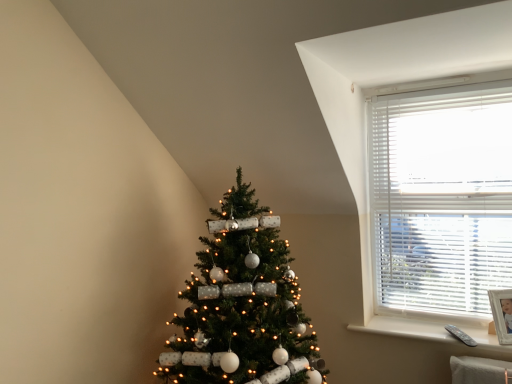
Question: From a real-world perspective, is green matte christmas tree at center located beneath white blinds at upper right?

Choices:
 (A) no
 (B) yes

Answer: (B)

Question: Are green matte christmas tree at center and white blinds at upper right located far from each other?

Choices:
 (A) no
 (B) yes

Answer: (A)

Question: Does green matte christmas tree at center have a larger size compared to white blinds at upper right?

Choices:
 (A) yes
 (B) no

Answer: (A)

Question: Does green matte christmas tree at center turn towards white blinds at upper right?

Choices:
 (A) yes
 (B) no

Answer: (B)

Question: Is green matte christmas tree at center not inside white blinds at upper right?

Choices:
 (A) yes
 (B) no

Answer: (A)

Question: Is green matte christmas tree at center bigger or smaller than white plastic remote at lower right?

Choices:
 (A) small
 (B) big

Answer: (B)

Question: Relative to white plastic remote at lower right, is green matte christmas tree at center in front or behind?

Choices:
 (A) front
 (B) behind

Answer: (A)

Question: From a real-world perspective, is green matte christmas tree at center positioned above or below white plastic remote at lower right?

Choices:
 (A) above
 (B) below

Answer: (A)

Question: Is green matte christmas tree at center inside the boundaries of white plastic remote at lower right, or outside?

Choices:
 (A) inside
 (B) outside

Answer: (B)

Question: Which is correct: green matte christmas tree at center is inside white blinds at upper right, or outside of it?

Choices:
 (A) inside
 (B) outside

Answer: (B)

Question: From the image's perspective, is green matte christmas tree at center above or below white blinds at upper right?

Choices:
 (A) above
 (B) below

Answer: (B)

Question: Is green matte christmas tree at center wider or thinner than white blinds at upper right?

Choices:
 (A) thin
 (B) wide

Answer: (B)

Question: Looking at the image, does green matte christmas tree at center seem bigger or smaller compared to white blinds at upper right?

Choices:
 (A) big
 (B) small

Answer: (A)

Question: Considering the positions of point (365, 331) and point (408, 284), is point (365, 331) closer or farther from the camera than point (408, 284)?

Choices:
 (A) farther
 (B) closer

Answer: (B)

Question: Looking at their shapes, would you say white plastic remote at lower right is wider or thinner than white blinds at upper right?

Choices:
 (A) wide
 (B) thin

Answer: (A)